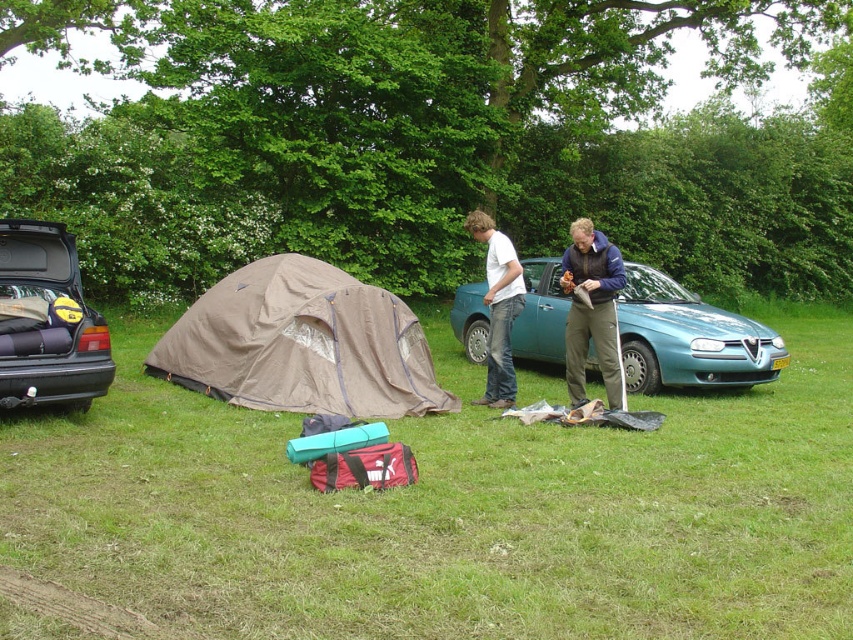
Does matte black car trunk at left have a greater width compared to blue fabric tent at center?

Yes.

Is point (67, 308) closer to camera compared to point (579, 312)?

That is True.

Does point (67, 257) come farther from viewer compared to point (619, 380)?

No, it is in front of (619, 380).

Locate an element on the screen. The image size is (853, 640). matte black car trunk at left is located at coordinates (47, 321).

Between point (762, 342) and point (509, 275), which one is positioned behind?

Positioned behind is point (762, 342).

Who is shorter, teal metallic car at center or blue fabric tent at center?

teal metallic car at center

Image resolution: width=853 pixels, height=640 pixels. What do you see at coordinates (688, 339) in the screenshot?
I see `teal metallic car at center` at bounding box center [688, 339].

Where is `teal metallic car at center`? This screenshot has width=853, height=640. teal metallic car at center is located at coordinates (688, 339).

Is point (10, 262) behind point (486, 228)?

No, (10, 262) is in front of (486, 228).

In the scene shown: Is matte black car trunk at left below white matte t-shirt at center?

Yes.

Is point (65, 390) positioned after point (482, 228)?

That is False.

Identify the location of matte black car trunk at left. (47, 321).